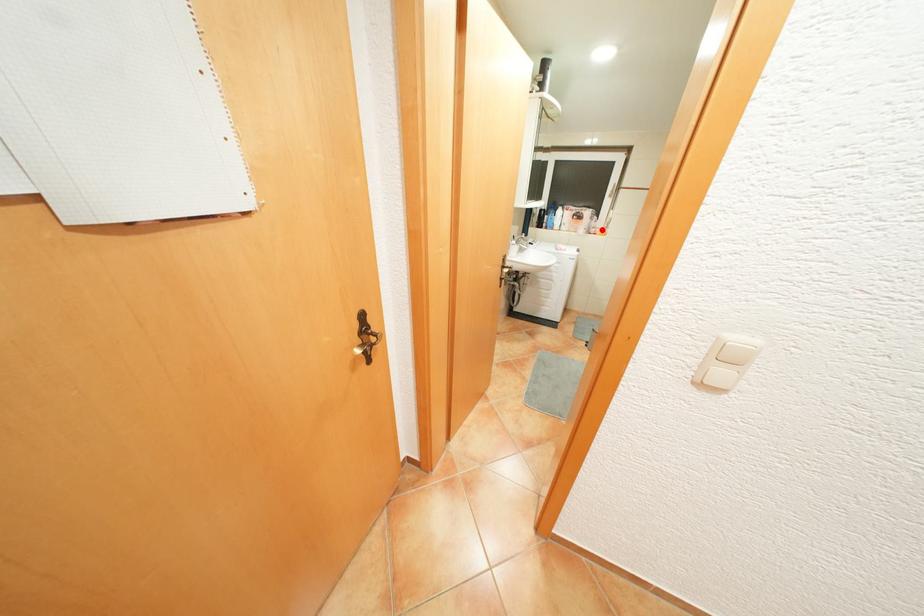
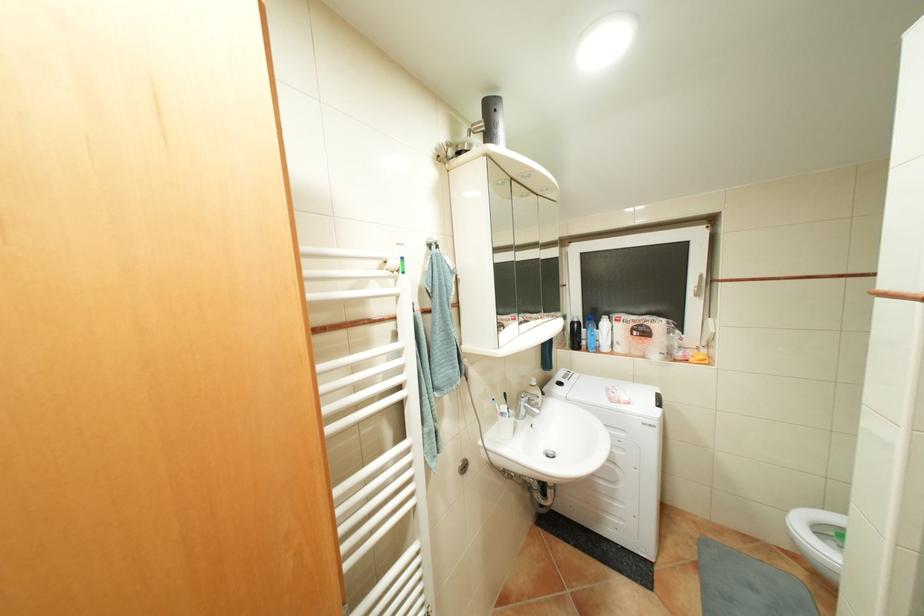
The point at the highlighted location is marked in the first image. Where is the corresponding point in the second image?

(688, 354)